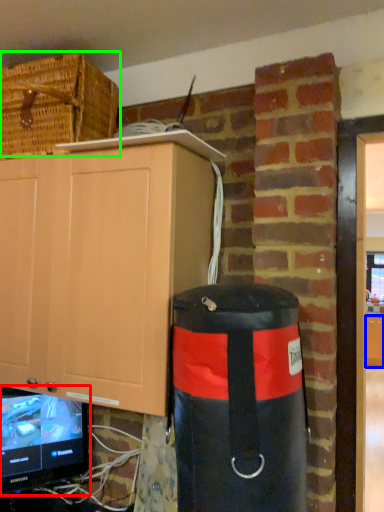
Question: Which object is the closest to the television (highlighted by a red box)? Choose among these: cabinetry (highlighted by a blue box) or basket (highlighted by a green box).

Choices:
 (A) cabinetry
 (B) basket

Answer: (B)